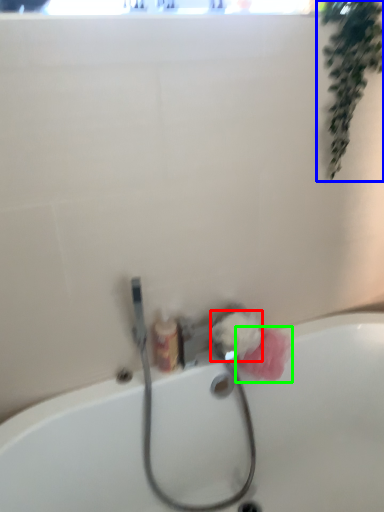
Question: Considering the real-world distances, which object is farthest from flower (highlighted by a red box)? plant (highlighted by a blue box) or flower (highlighted by a green box)?

Choices:
 (A) plant
 (B) flower

Answer: (A)